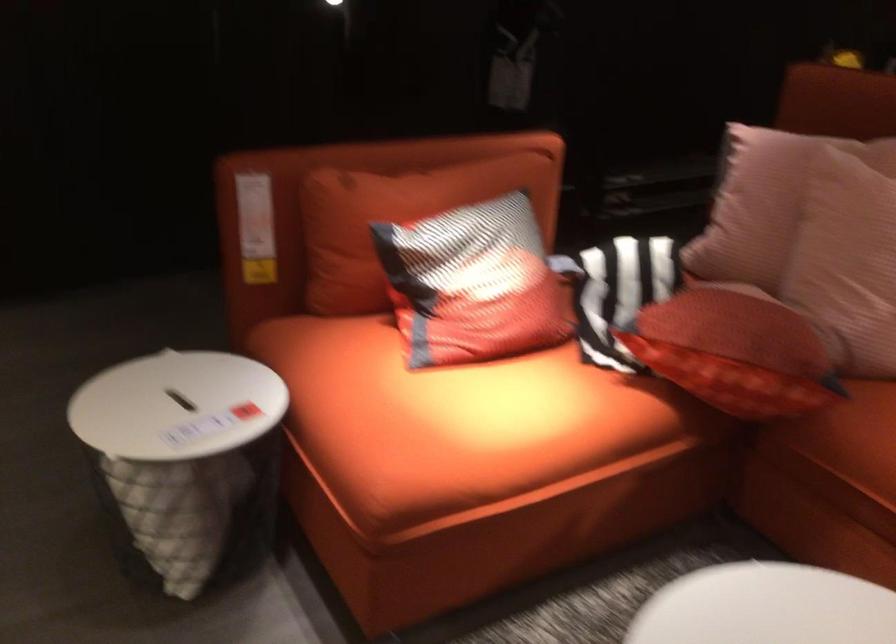
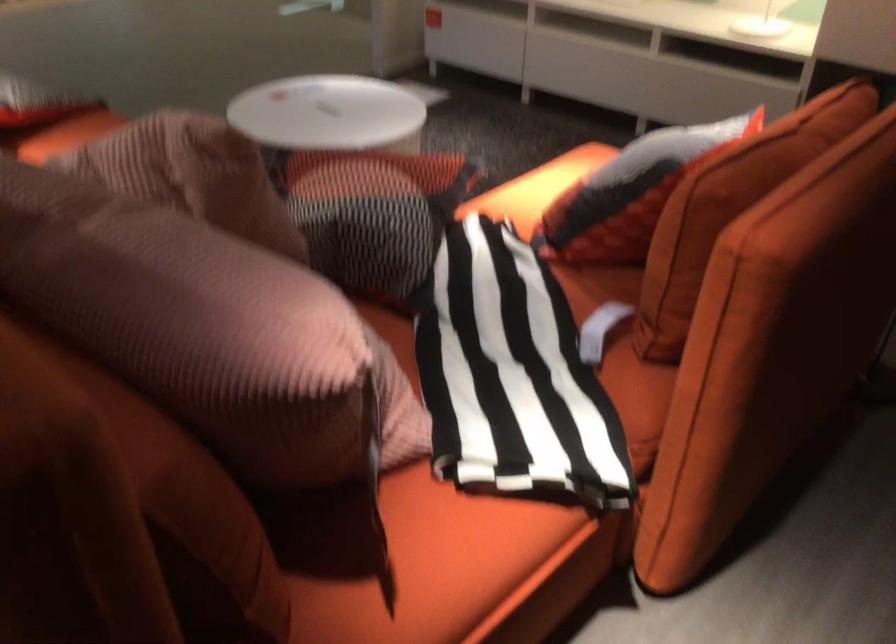
Locate, in the second image, the point that corresponds to (x=631, y=270) in the first image.

(512, 375)